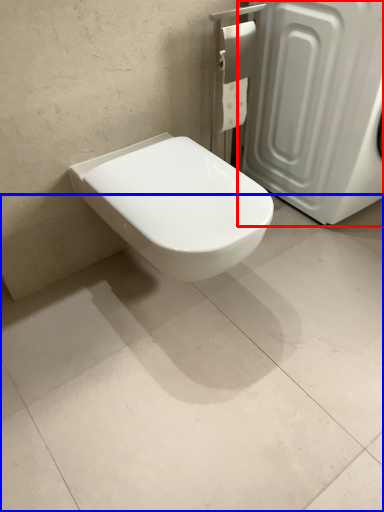
Question: Among these objects, which one is farthest to the camera, screen door (highlighted by a red box) or concrete (highlighted by a blue box)?

Choices:
 (A) screen door
 (B) concrete

Answer: (A)